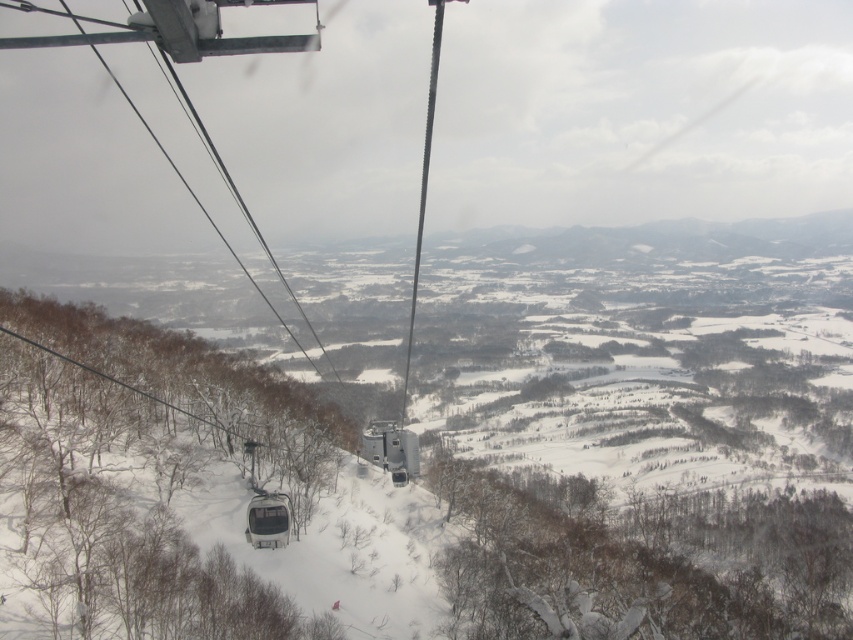
You are a skier planning to take the white metallic ski lift at center to reach the top of the mountain. If the coordinates of the ski lift are at point 0.098, 0.218, can you estimate its location relative to the center of the image?

The white metallic ski lift at center is located at coordinates (184, 61), which is slightly to the left and below the exact center of the image.

You are a skier planning to take the metallic gray ski lift at center and the metallic cable car at center to reach the summit. Which one should you board first according to their positions?

You should board the metallic gray ski lift at center first because it is positioned below the metallic cable car at center, meaning it is closer to your current location.